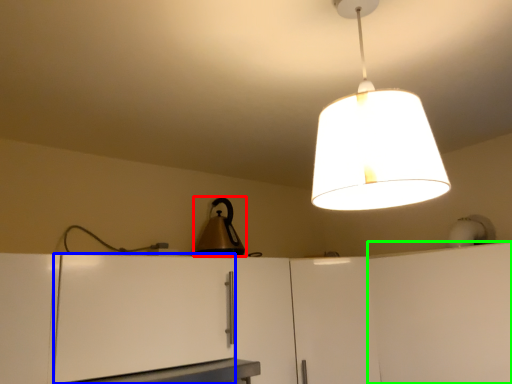
Question: Which is farther away from appliance (highlighted by a red box)? cabinetry (highlighted by a blue box) or cabinetry (highlighted by a green box)?

Choices:
 (A) cabinetry
 (B) cabinetry

Answer: (B)